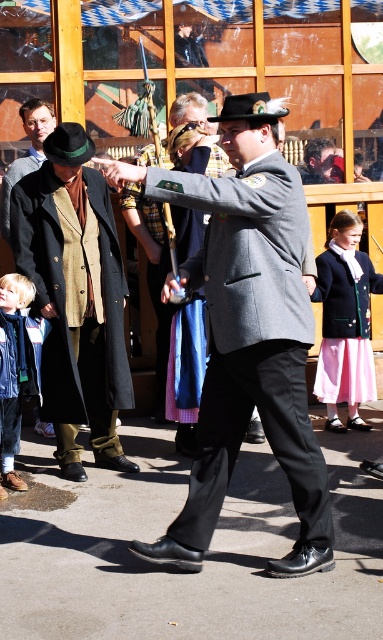
Question: Which point appears closest to the camera in this image?

Choices:
 (A) (0, 204)
 (B) (242, 433)
 (C) (206, 157)
 (D) (364, 364)

Answer: (B)

Question: Can you confirm if matte black blazer at center is wider than brown wool coat at left?

Choices:
 (A) yes
 (B) no

Answer: (A)

Question: Among these points, which one is farthest from the camera?

Choices:
 (A) (27, 368)
 (B) (153, 259)
 (C) (286, 241)
 (D) (42, 157)

Answer: (D)

Question: Is matte gray uniform at center smaller than denim jacket at lower left?

Choices:
 (A) no
 (B) yes

Answer: (A)

Question: Which object is the closest to the matte gray coat at center?

Choices:
 (A) matte black blazer at center
 (B) denim jacket at lower left

Answer: (A)

Question: Does matte gray coat at center appear on the right side of denim jacket at lower left?

Choices:
 (A) no
 (B) yes

Answer: (B)